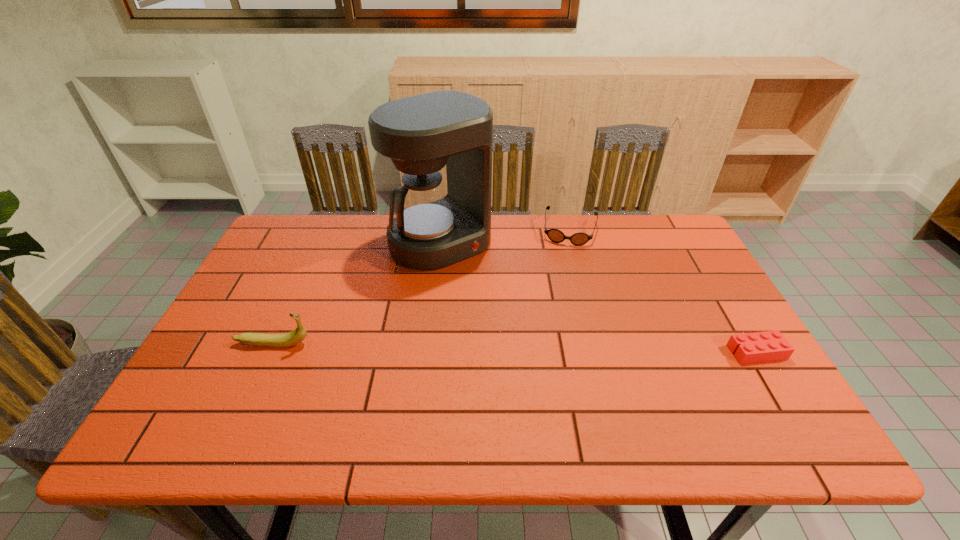
Image resolution: width=960 pixels, height=540 pixels. I want to click on vacant space on the desktop that is between the leftmost object and the rightmost object and is positioned on the front-facing side of the coffee maker, so click(543, 348).

You are a GUI agent. You are given a task and a screenshot of the screen. Output one action in this format:
    pyautogui.click(x=<x>, y=<y>)
    Task: Click on the vacant space on the desktop that is between the leftmost object and the shortest object and is positioned on the lenses of the second object from right to left
    This screenshot has width=960, height=540.
    Given the screenshot: What is the action you would take?
    pyautogui.click(x=552, y=349)